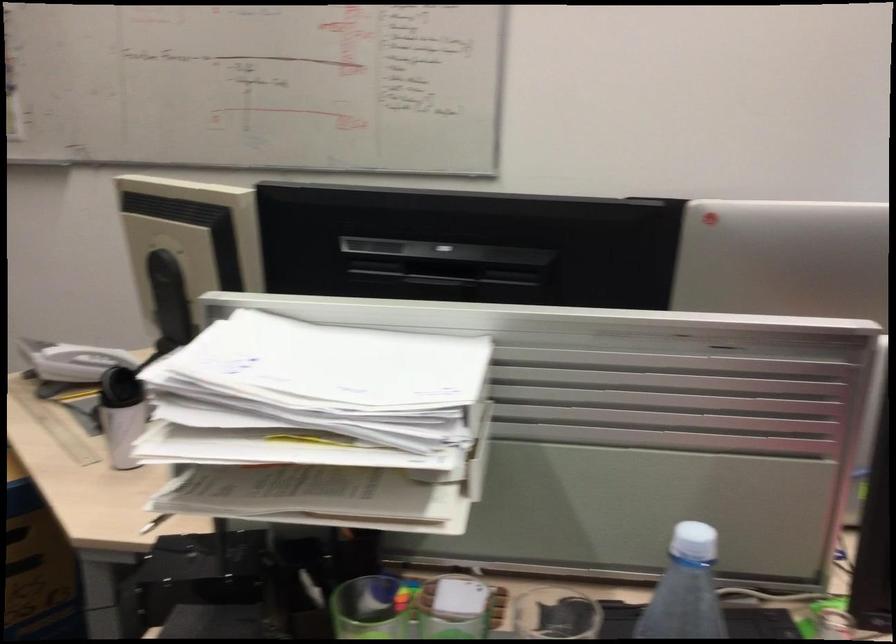
Where is `white bottle cap`? white bottle cap is located at coordinates (693, 543).